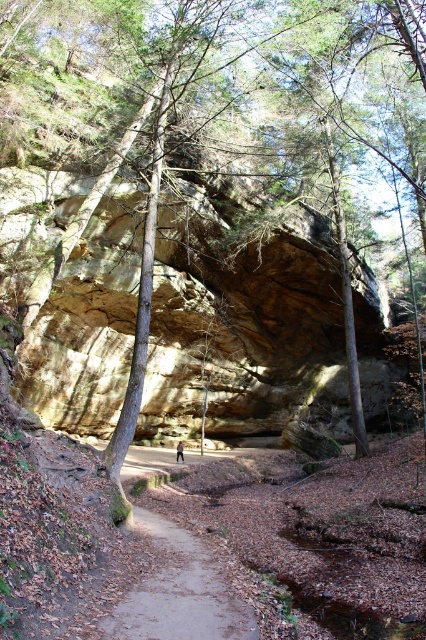
You are standing on the brown dirt path at center and want to reach the blue fabric person at center. Which direction should you move to get closer to them?

The brown dirt path at center is in front of the blue fabric person at center, so you should move backward to reach them.

You are a hiker carrying a backpack and you see the brown dirt path at center and the blue fabric person at center. Which one is wider?

The brown dirt path at center is wider than the blue fabric person at center because the path surpasses the person in width.

You are standing at the entrance of the forest and see the brown dirt path at center and the blue fabric person at center. Which object is larger in size?

The blue fabric person at center is larger than the brown dirt path at center.